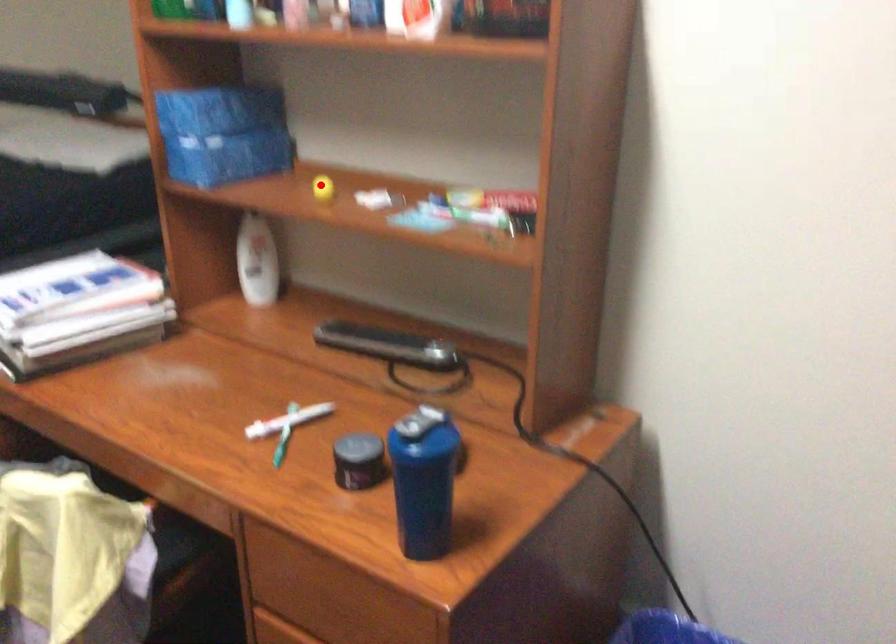
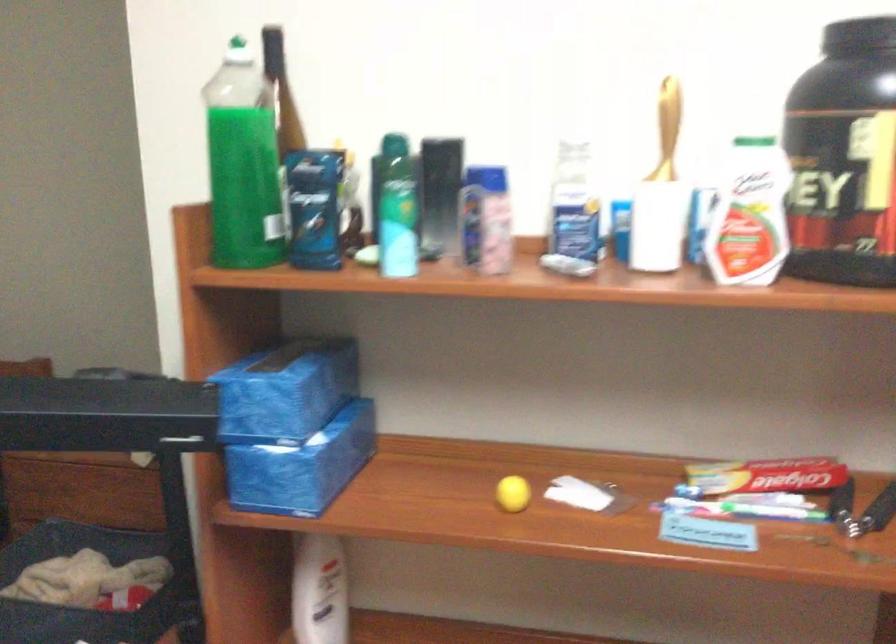
Find the pixel in the second image that matches the highlighted location in the first image.

(513, 494)